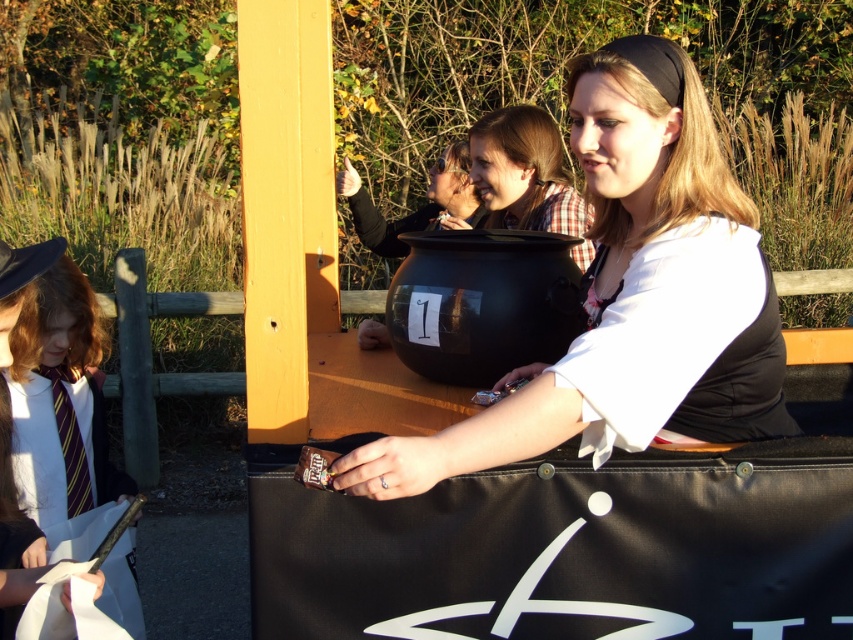
Question: Does matte black cauldron at center appear on the left side of white shirt with tie at left?

Choices:
 (A) no
 (B) yes

Answer: (A)

Question: Can you confirm if matte black cauldron at center is positioned to the left of white shirt with tie at left?

Choices:
 (A) yes
 (B) no

Answer: (B)

Question: Can you confirm if matte black cauldron at center is wider than white shirt with tie at left?

Choices:
 (A) no
 (B) yes

Answer: (B)

Question: Which point is closer to the camera taking this photo?

Choices:
 (A) (55, 552)
 (B) (718, 275)

Answer: (B)